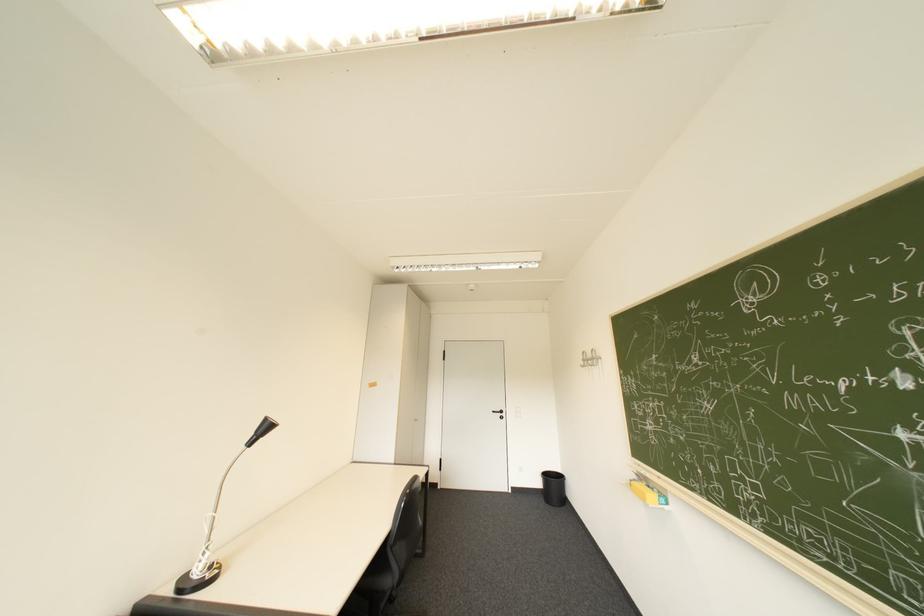
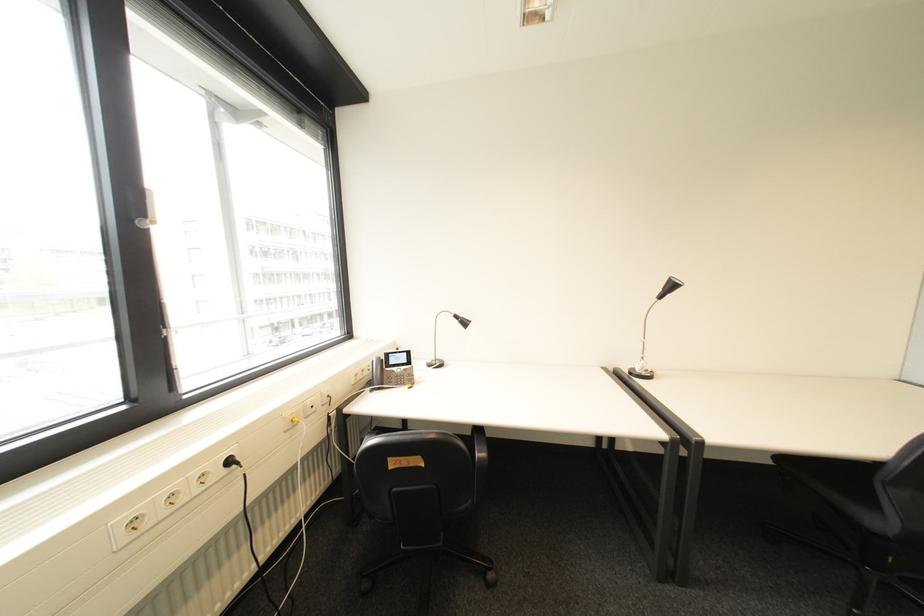
Where in the second image is the point corresponding to point (266, 434) from the first image?

(673, 290)